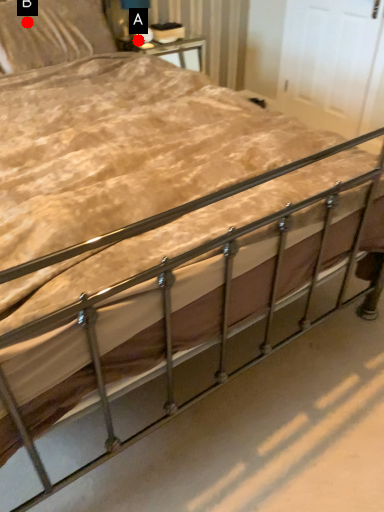
Question: Two points are circled on the image, labeled by A and B beside each circle. Which of the following is the farthest from the observer?

Choices:
 (A) A is further
 (B) B is further

Answer: (A)